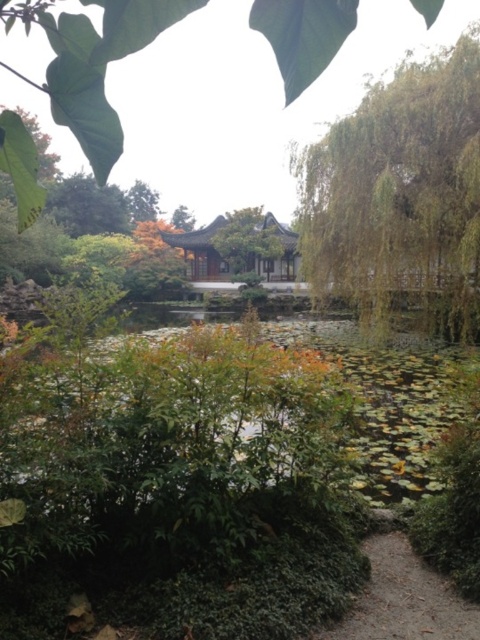
You are standing in the garden and want to take a photo of the green leafy tree at upper right and the green leafy tree at upper center. Which tree is positioned lower in the frame?

The green leafy tree at upper right is located below the green leafy tree at upper center, so it is positioned lower in the frame.

You are a visitor walking along the garden path and want to take a photo of both the green matte tree at center and the green leafy tree at upper center. Which tree should you position closer to the camera to ensure both are in focus?

You should position yourself closer to the green matte tree at center because it is in front of the green leafy tree at upper center, ensuring both are in focus when the foreground tree is closer to the camera.